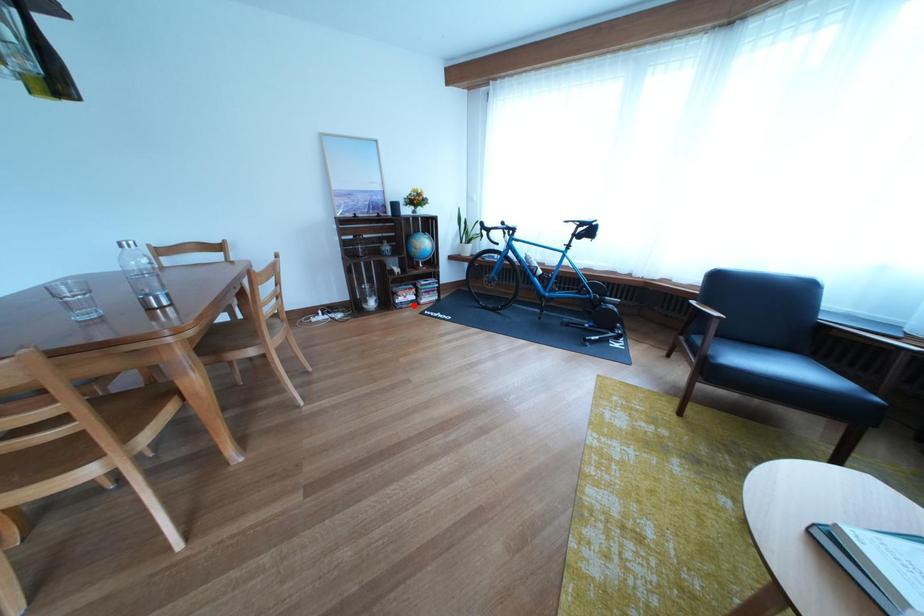
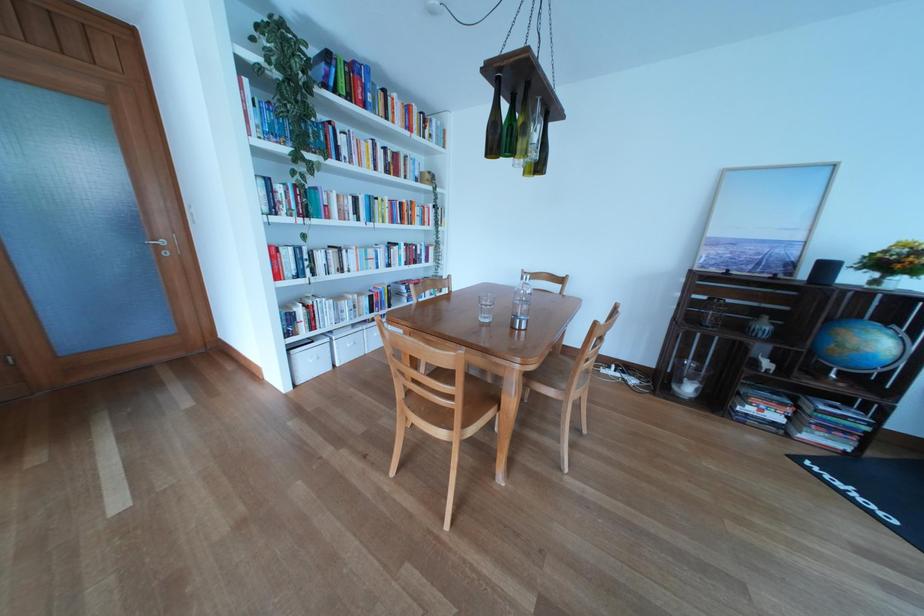
Locate, in the second image, the point that corresponds to the highlighted location in the first image.

(762, 416)